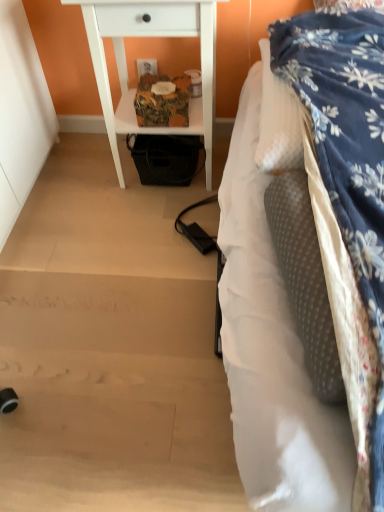
Where is `free spot in front of white wood nightstand at upper center`? The image size is (384, 512). free spot in front of white wood nightstand at upper center is located at coordinates (142, 234).